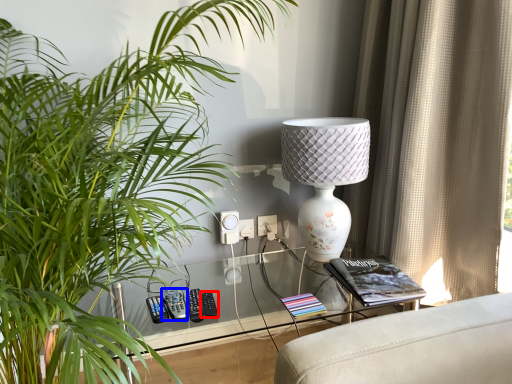
Question: Which point is further to the camera, control (highlighted by a red box) or control (highlighted by a blue box)?

Choices:
 (A) control
 (B) control

Answer: (A)